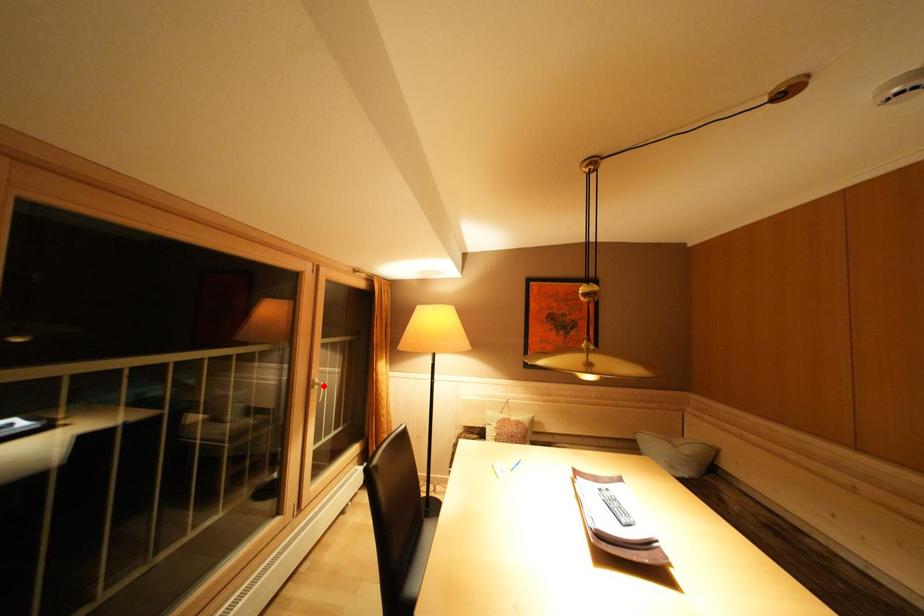
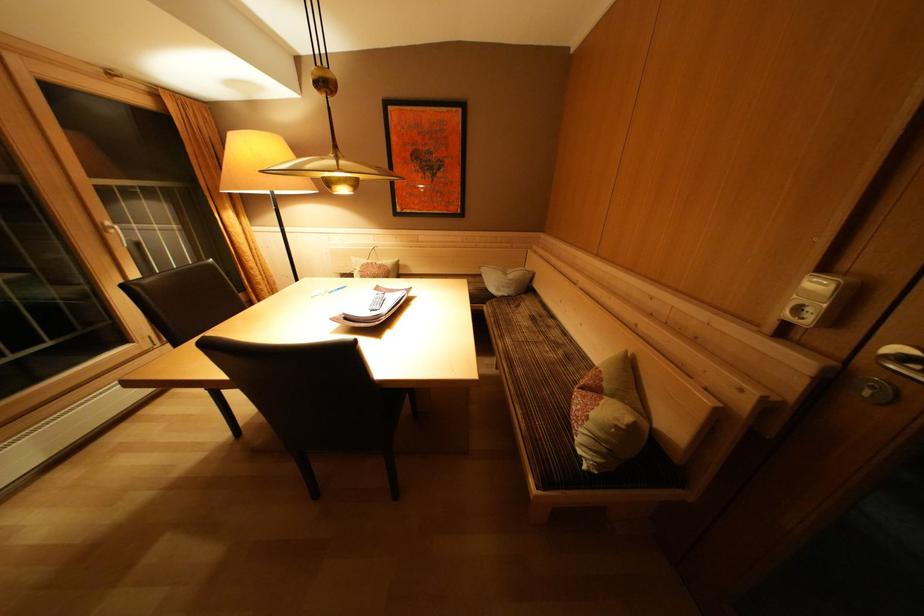
Where in the second image is the point corresponding to the highlighted location from the first image?

(116, 229)